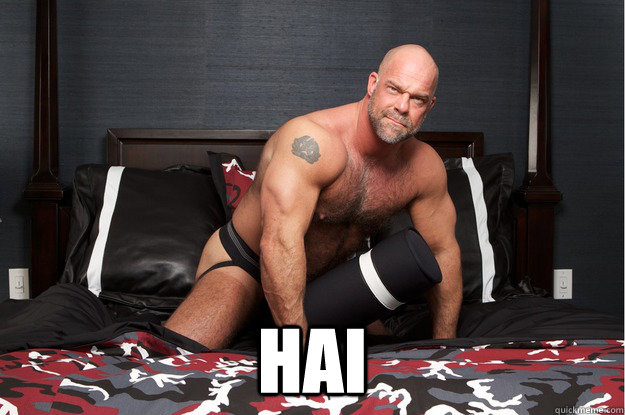
Locate an element on the screen. The height and width of the screenshot is (415, 625). outlet is located at coordinates (560, 287).